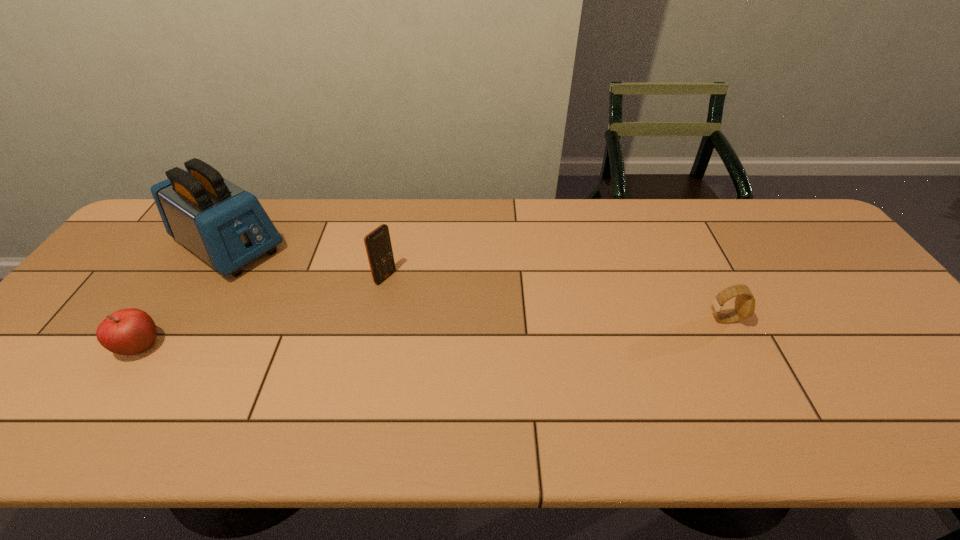
Find the location of a particular element. This screenshot has width=960, height=540. free space on the desktop that is between the apple and the rightmost object and is positioned on the front-facing side of the tallest object is located at coordinates (360, 336).

What are the coordinates of `vacant space on the desktop that is between the apple and the watch and is positioned on the screen of the second object from right to left` in the screenshot? It's located at (479, 330).